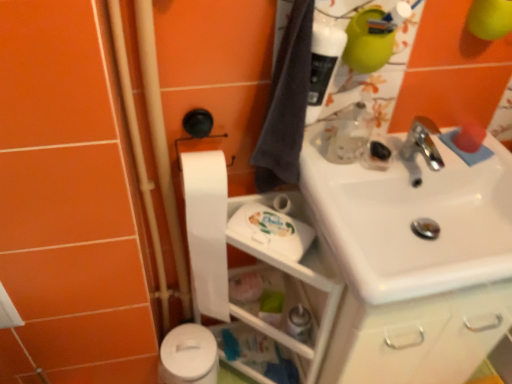
Question: From the image's perspective, is translucent plastic bottle at upper right located beneath white matte toilet paper at center-left, which is the first toilet paper from top to bottom?

Choices:
 (A) no
 (B) yes

Answer: (A)

Question: Is there a large distance between translucent plastic bottle at upper right and white matte toilet paper at center-left, which is the 2th toilet paper from bottom to top?

Choices:
 (A) no
 (B) yes

Answer: (A)

Question: From the image's perspective, does translucent plastic bottle at upper right appear higher than white matte toilet paper at center-left, which is the 2th toilet paper from bottom to top?

Choices:
 (A) yes
 (B) no

Answer: (A)

Question: Is translucent plastic bottle at upper right positioned beyond the bounds of white matte toilet paper at center-left, which is the first toilet paper from top to bottom?

Choices:
 (A) no
 (B) yes

Answer: (B)

Question: Does translucent plastic bottle at upper right have a larger size compared to white matte toilet paper at center-left, which is the 2th toilet paper from bottom to top?

Choices:
 (A) no
 (B) yes

Answer: (A)

Question: Visually, is translucent plastic bottle at upper right positioned to the left or to the right of white glossy sink at upper right?

Choices:
 (A) left
 (B) right

Answer: (A)

Question: In terms of width, does translucent plastic bottle at upper right look wider or thinner when compared to white glossy sink at upper right?

Choices:
 (A) thin
 (B) wide

Answer: (A)

Question: From the image's perspective, is translucent plastic bottle at upper right above or below white glossy sink at upper right?

Choices:
 (A) below
 (B) above

Answer: (B)

Question: In terms of height, does translucent plastic bottle at upper right look taller or shorter compared to white glossy sink at upper right?

Choices:
 (A) tall
 (B) short

Answer: (A)

Question: From a real-world perspective, relative to dark gray fabric bath towel at upper right, is white plastic shelf at lower center vertically above or below?

Choices:
 (A) below
 (B) above

Answer: (A)

Question: In terms of size, does white plastic shelf at lower center appear bigger or smaller than dark gray fabric bath towel at upper right?

Choices:
 (A) small
 (B) big

Answer: (B)

Question: In terms of width, does white plastic shelf at lower center look wider or thinner when compared to dark gray fabric bath towel at upper right?

Choices:
 (A) wide
 (B) thin

Answer: (A)

Question: From the image's perspective, is white plastic shelf at lower center above or below dark gray fabric bath towel at upper right?

Choices:
 (A) below
 (B) above

Answer: (A)

Question: Looking at the image, does translucent plastic spray bottle at lower center seem bigger or smaller compared to translucent plastic bottle at upper right?

Choices:
 (A) small
 (B) big

Answer: (A)

Question: From a real-world perspective, is translucent plastic spray bottle at lower center positioned above or below translucent plastic bottle at upper right?

Choices:
 (A) above
 (B) below

Answer: (B)